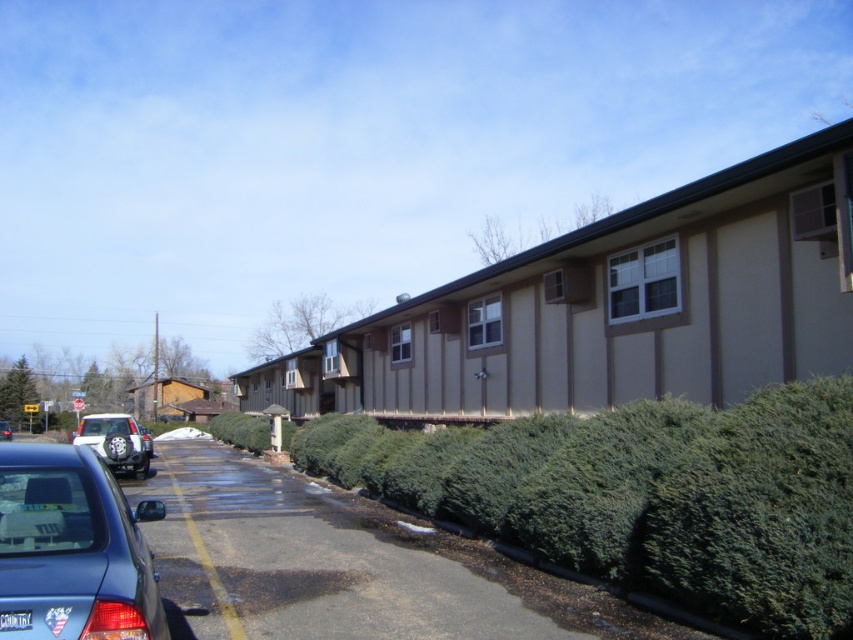
Is green bushy hedge at center bigger than metallic blue sedan at lower left?

Yes.

Between green bushy hedge at center and metallic blue sedan at lower left, which one appears on the left side from the viewer's perspective?

From the viewer's perspective, metallic blue sedan at lower left appears more on the left side.

Is point (459, 465) farther from camera compared to point (82, 508)?

Yes, point (459, 465) is behind point (82, 508).

At what (x,y) coordinates should I click in order to perform the action: click on green bushy hedge at center. Please return your answer as a coordinate pair (x, y). The height and width of the screenshot is (640, 853). Looking at the image, I should click on (643, 496).

Does green bushy hedge at center have a lesser height compared to metallic silver sedan at lower left?

No.

Does point (677, 451) come farther from viewer compared to point (6, 433)?

That is False.

Who is more forward, (x=550, y=429) or (x=10, y=435)?

Point (x=550, y=429)

At what (x,y) coordinates should I click in order to perform the action: click on green bushy hedge at center. Please return your answer as a coordinate pair (x, y). Looking at the image, I should click on (643, 496).

Where is `metallic blue sedan at lower left`? metallic blue sedan at lower left is located at coordinates (73, 548).

Between metallic blue sedan at lower left and metallic silver sedan at lower left, which one has more height?

metallic silver sedan at lower left

Is point (141, 538) positioned after point (9, 429)?

That is False.

This screenshot has height=640, width=853. I want to click on metallic blue sedan at lower left, so click(73, 548).